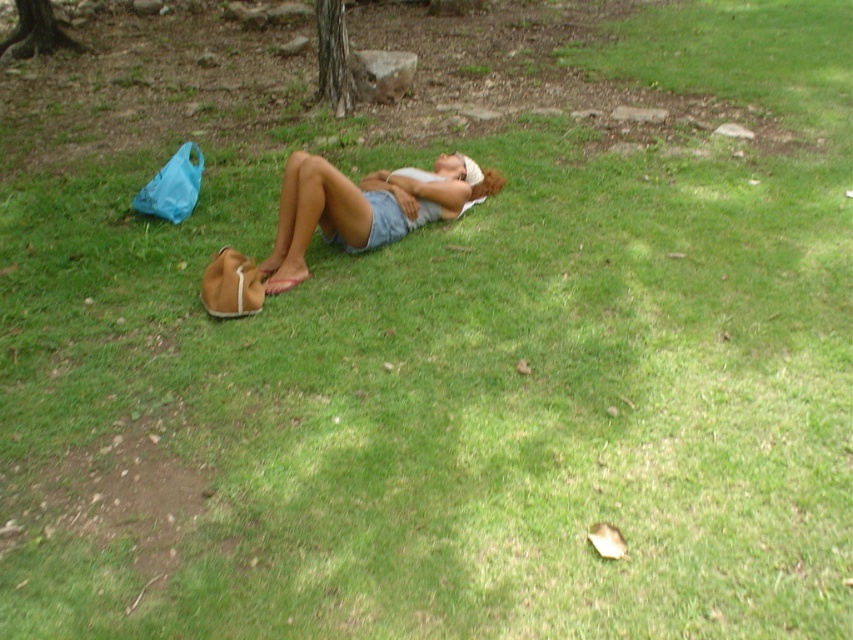
Question: Does brown textured tree trunk at upper center appear on the left side of brown textured tree trunk at upper left?

Choices:
 (A) yes
 (B) no

Answer: (B)

Question: Can you confirm if denim shorts at center is positioned to the left of brown textured tree trunk at upper left?

Choices:
 (A) yes
 (B) no

Answer: (B)

Question: Which of the following is the closest to the observer?

Choices:
 (A) brown textured tree trunk at upper left
 (B) brown textured tree trunk at upper center
 (C) denim shorts at center

Answer: (C)

Question: Can you confirm if denim shorts at center is positioned to the right of brown textured tree trunk at upper left?

Choices:
 (A) no
 (B) yes

Answer: (B)

Question: Which of the following is the closest to the observer?

Choices:
 (A) (28, 49)
 (B) (430, 193)

Answer: (B)

Question: Which object is positioned closest to the brown textured tree trunk at upper center?

Choices:
 (A) denim shorts at center
 (B) brown textured tree trunk at upper left

Answer: (A)